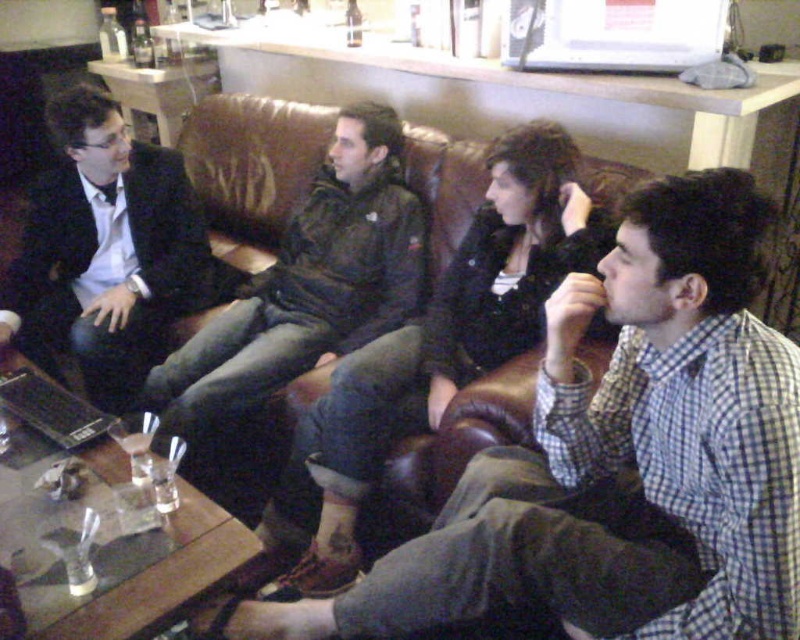
Question: Estimate the real-world distances between objects in this image. Which object is closer to the leather jacket at center?

Choices:
 (A) black plastic laptop at lower left
 (B) matte black suit at left

Answer: (A)

Question: Among these objects, which one is farthest from the camera?

Choices:
 (A) dark green jacket at center
 (B) matte black suit at left
 (C) black plastic laptop at lower left
 (D) leather jacket at center

Answer: (B)

Question: Is leather jacket at center smaller than black plastic laptop at lower left?

Choices:
 (A) yes
 (B) no

Answer: (B)

Question: Observing the image, what is the correct spatial positioning of leather jacket at center in reference to dark green jacket at center?

Choices:
 (A) right
 (B) left

Answer: (A)

Question: Can you confirm if leather jacket at center is positioned above matte black suit at left?

Choices:
 (A) yes
 (B) no

Answer: (B)

Question: Among these objects, which one is nearest to the camera?

Choices:
 (A) matte black suit at left
 (B) leather jacket at center

Answer: (B)